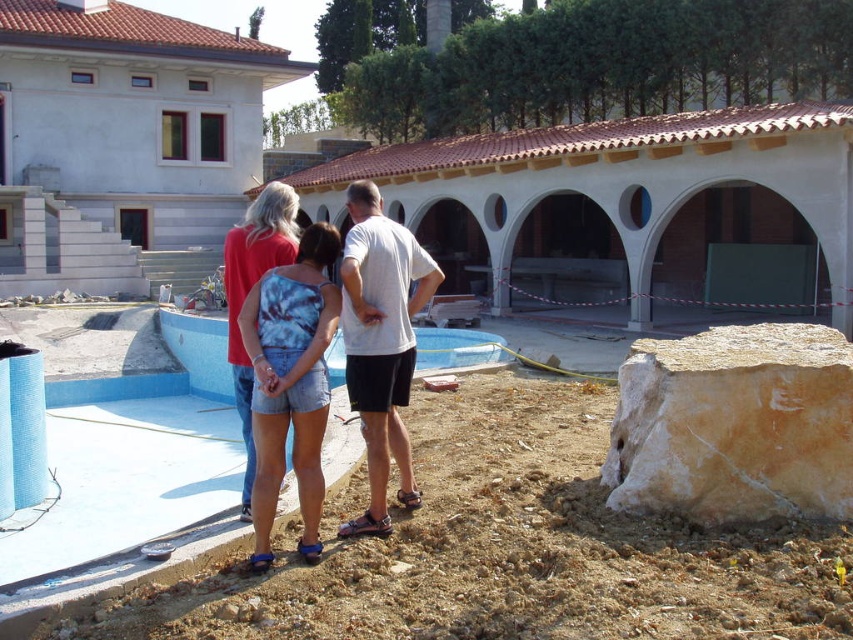
Question: Is blue tie-dye tank top at center closer to camera compared to blue smooth pool at center?

Choices:
 (A) yes
 (B) no

Answer: (A)

Question: Which is nearer to the blue smooth pool at center?

Choices:
 (A) tie-dye fabric tank top at center
 (B) white cotton shirt at center
 (C) yellowish stone boulder at lower right
 (D) blue tie-dye tank top at center

Answer: (A)

Question: Can you confirm if yellowish stone boulder at lower right is positioned to the left of tie-dye fabric tank top at center?

Choices:
 (A) yes
 (B) no

Answer: (B)

Question: Is yellowish stone boulder at lower right thinner than tie-dye fabric shorts at center?

Choices:
 (A) no
 (B) yes

Answer: (A)

Question: Among these objects, which one is farthest from the camera?

Choices:
 (A) white cotton shirt at center
 (B) blue smooth pool at center
 (C) tie-dye fabric shorts at center
 (D) tie-dye fabric tank top at center

Answer: (B)

Question: Among these points, which one is farthest from the camera?

Choices:
 (A) (741, 445)
 (B) (212, 368)
 (C) (374, 509)

Answer: (B)